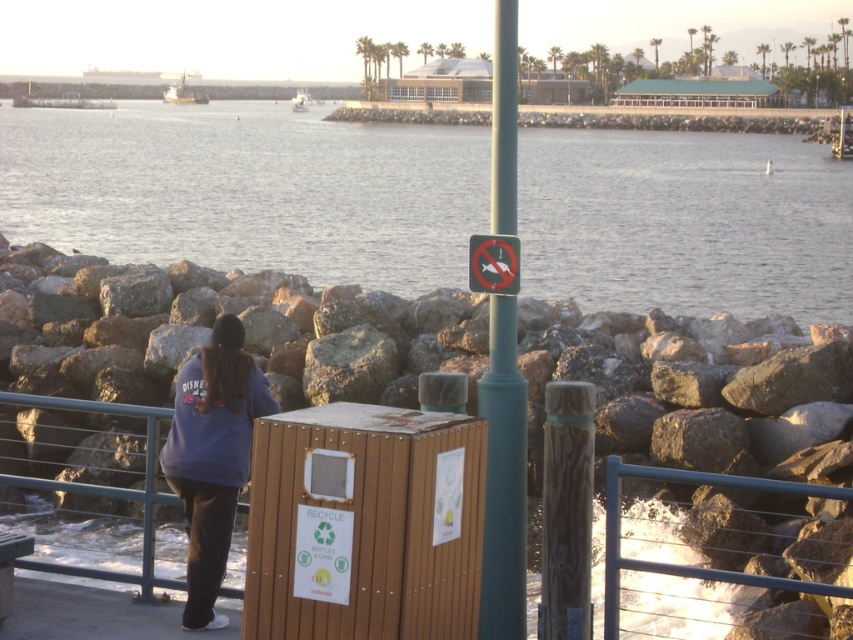
Question: Which object is positioned farthest from the wooden trash bin at center?

Choices:
 (A) purple fleece jacket at lower left
 (B) green metallic pole at center
 (C) smooth water at center

Answer: (C)

Question: Can you confirm if wooden trash bin at center is positioned to the right of purple fleece jacket at lower left?

Choices:
 (A) yes
 (B) no

Answer: (A)

Question: Which of the following is the closest to the observer?

Choices:
 (A) purple fleece jacket at lower left
 (B) wooden trash bin at center
 (C) smooth water at center

Answer: (B)

Question: Is smooth water at center positioned behind wooden trash bin at center?

Choices:
 (A) yes
 (B) no

Answer: (A)

Question: Which of the following is the farthest from the observer?

Choices:
 (A) green metallic pole at center
 (B) smooth water at center
 (C) purple fleece jacket at lower left

Answer: (C)

Question: Can you confirm if purple fleece jacket at lower left is smaller than blue metal rail at lower right?

Choices:
 (A) no
 (B) yes

Answer: (B)